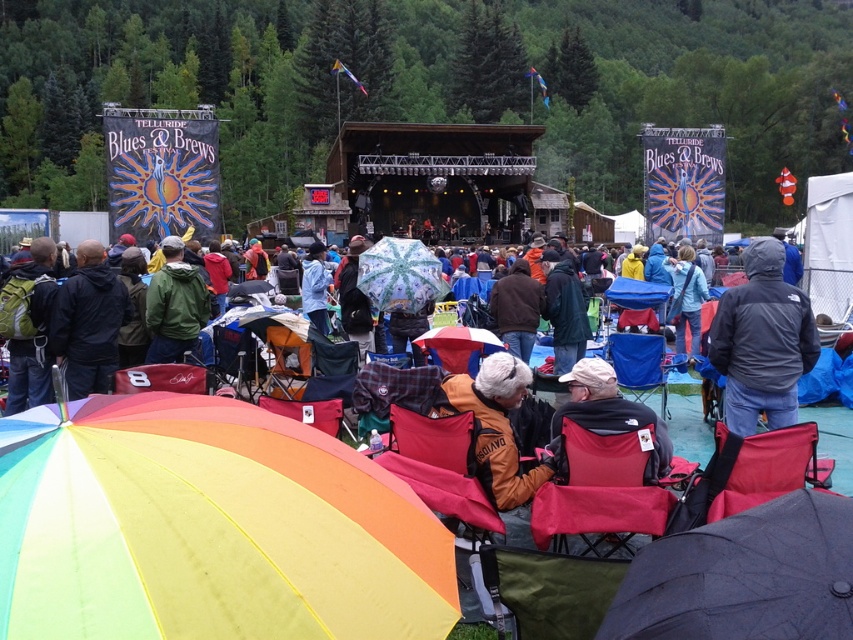
You are standing at the center of the festival area and want to locate the rainbow fabric umbrella at lower left. According to the coordinates provided, in which direction should you look to find it?

The rainbow fabric umbrella at lower left is located at coordinates point (207,528), so you should look to the lower left direction to find it.

You are an attendee at the festival and want to take a photo of the white matte jacket at center without the rainbow fabric umbrella at lower left blocking the view. Can you move to a position where the jacket is visible without the umbrella obstructing it?

The rainbow fabric umbrella at lower left is in front of the white matte jacket at center, so moving behind the umbrella or to the side might allow you to see the jacket without obstruction.

You are at the Telluride Blues and Brews Festival and want to find the green matte jacket at center. If you are standing at the point with coordinates (x=173, y=305), where exactly are you located?

The point (x=173, y=305) is on the green matte jacket at center, so you are standing directly on the green matte jacket at center.